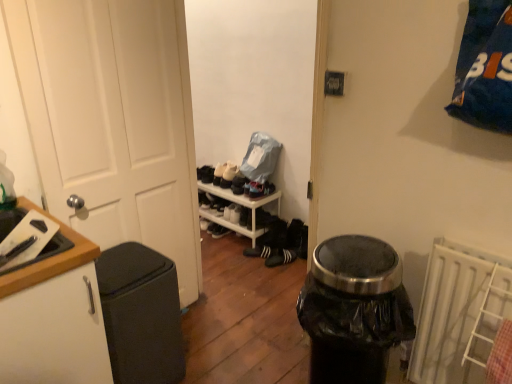
Question: Is white suede shoe at center, which is the first shoe from top to bottom, wider or thinner than white plastic shelf at center?

Choices:
 (A) thin
 (B) wide

Answer: (A)

Question: From the image's perspective, is white suede shoe at center, which is the first shoe from top to bottom, above or below white plastic shelf at center?

Choices:
 (A) below
 (B) above

Answer: (B)

Question: Estimate the real-world distances between objects in this image. Which object is farther from the white matte door at left?

Choices:
 (A) suede black shoe at center, which is the second shoe in bottom-to-top order
 (B) black suede sneakers at center, which is the 2th footwear in left-to-right order
 (C) white matte sneakers at center, arranged as the first footwear when viewed from the left
 (D) wooden cutting board at left
 (E) white matte cabinet at left

Answer: (C)

Question: Considering the real-world distances, which object is closest to the white plastic shelf at center?

Choices:
 (A) white matte cabinet at left
 (B) white matte sneakers at center, marked as the 2th footwear in a right-to-left arrangement
 (C) black matte trash can at left
 (D) white matte door at left
 (E) white suede shoe at center, which is the first shoe from top to bottom

Answer: (E)